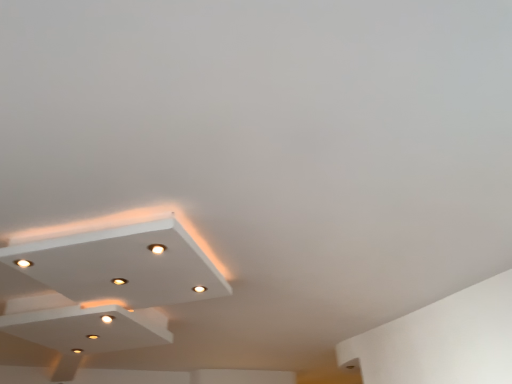
Question: Is white matte exhaust hood at lower left completely or partially outside of matte white droplight at center?

Choices:
 (A) no
 (B) yes

Answer: (B)

Question: Is white matte exhaust hood at lower left taller than matte white droplight at center?

Choices:
 (A) yes
 (B) no

Answer: (A)

Question: Does white matte exhaust hood at lower left lie behind matte white droplight at center?

Choices:
 (A) no
 (B) yes

Answer: (B)

Question: Considering the relative sizes of white matte exhaust hood at lower left and matte white droplight at center in the image provided, is white matte exhaust hood at lower left smaller than matte white droplight at center?

Choices:
 (A) no
 (B) yes

Answer: (A)

Question: Is white matte exhaust hood at lower left positioned with its back to matte white droplight at center?

Choices:
 (A) yes
 (B) no

Answer: (B)

Question: From a real-world perspective, is white glossy ceiling light at lower left physically located above or below white matte exhaust hood at lower left?

Choices:
 (A) above
 (B) below

Answer: (A)

Question: In terms of width, does white glossy ceiling light at lower left look wider or thinner when compared to white matte exhaust hood at lower left?

Choices:
 (A) wide
 (B) thin

Answer: (A)

Question: Is point (2, 253) positioned closer to the camera than point (102, 312)?

Choices:
 (A) farther
 (B) closer

Answer: (B)

Question: From the image's perspective, is white glossy ceiling light at lower left located above or below white matte exhaust hood at lower left?

Choices:
 (A) below
 (B) above

Answer: (B)

Question: From a real-world perspective, is white glossy ceiling light at lower left positioned above or below matte white droplight at center?

Choices:
 (A) above
 (B) below

Answer: (A)

Question: Based on their positions, is white glossy ceiling light at lower left located to the left or right of matte white droplight at center?

Choices:
 (A) right
 (B) left

Answer: (B)

Question: In terms of height, does white glossy ceiling light at lower left look taller or shorter compared to matte white droplight at center?

Choices:
 (A) tall
 (B) short

Answer: (A)

Question: Do you think white glossy ceiling light at lower left is within matte white droplight at center, or outside of it?

Choices:
 (A) inside
 (B) outside

Answer: (B)

Question: Looking at their shapes, would you say white matte exhaust hood at lower left is wider or thinner than matte white light at center?

Choices:
 (A) thin
 (B) wide

Answer: (B)

Question: Would you say white matte exhaust hood at lower left is to the left or to the right of matte white light at center in the picture?

Choices:
 (A) left
 (B) right

Answer: (A)